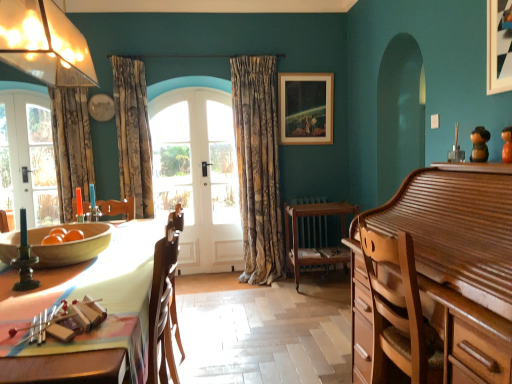
Question: Is white glass door at center taller than glossy wood cabinet at right?

Choices:
 (A) yes
 (B) no

Answer: (A)

Question: Does white glass door at center have a smaller size compared to glossy wood cabinet at right?

Choices:
 (A) yes
 (B) no

Answer: (A)

Question: Can you confirm if white glass door at center is shorter than glossy wood cabinet at right?

Choices:
 (A) no
 (B) yes

Answer: (A)

Question: Is white glass door at center further to the viewer compared to glossy wood cabinet at right?

Choices:
 (A) yes
 (B) no

Answer: (A)

Question: From the image's perspective, is white glass door at center over glossy wood cabinet at right?

Choices:
 (A) yes
 (B) no

Answer: (A)

Question: Does white glass door at center have a greater width compared to glossy wood cabinet at right?

Choices:
 (A) no
 (B) yes

Answer: (A)

Question: Is white glass door at center in contact with wooden chair at center?

Choices:
 (A) yes
 (B) no

Answer: (B)

Question: Is white glass door at center at the right side of wooden chair at center?

Choices:
 (A) yes
 (B) no

Answer: (B)

Question: Considering the relative positions of white glass door at center and wooden chair at center in the image provided, is white glass door at center in front of wooden chair at center?

Choices:
 (A) no
 (B) yes

Answer: (A)

Question: From the image's perspective, is white glass door at center below wooden chair at center?

Choices:
 (A) yes
 (B) no

Answer: (B)

Question: Is white glass door at center outside wooden chair at center?

Choices:
 (A) no
 (B) yes

Answer: (B)

Question: Is white glass door at center wider than wooden chair at center?

Choices:
 (A) no
 (B) yes

Answer: (A)

Question: From a real-world perspective, is gold-patterned fabric curtain at center, acting as the 1th curtain starting from the right, physically above floral fabric curtain at left, which appears as the 2th curtain when viewed from the left?

Choices:
 (A) no
 (B) yes

Answer: (A)